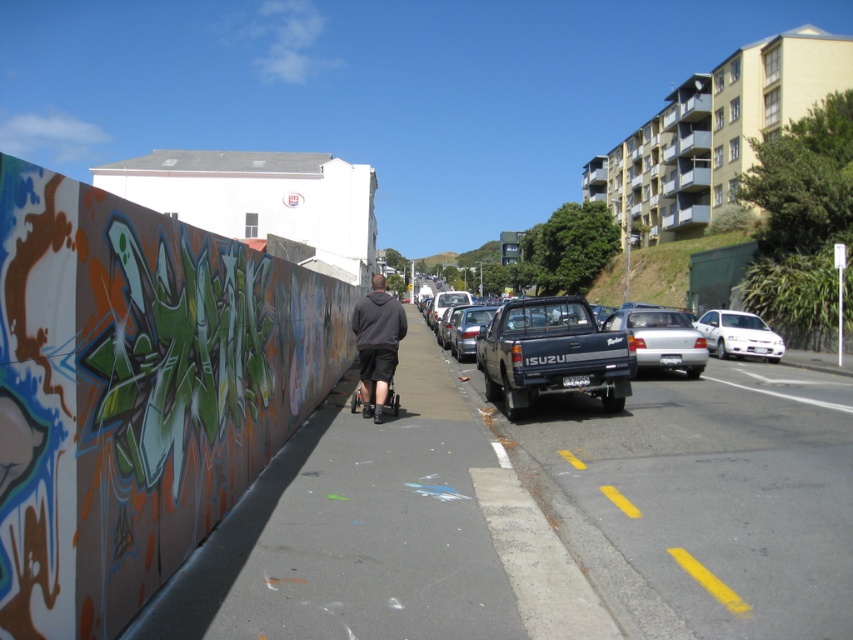
Can you confirm if black asphalt road at center is positioned to the left of matte black pickup truck at center?

In fact, black asphalt road at center is to the right of matte black pickup truck at center.

Identify the location of black asphalt road at center. (700, 497).

Who is higher up, black asphalt road at center or silver metallic sedan at center-right?

silver metallic sedan at center-right

Locate an element on the screen. This screenshot has height=640, width=853. black asphalt road at center is located at coordinates (700, 497).

Describe the element at coordinates (700, 497) in the screenshot. I see `black asphalt road at center` at that location.

Locate an element on the screen. The height and width of the screenshot is (640, 853). black asphalt road at center is located at coordinates (700, 497).

Is gray asphalt sidewalk at center taller than matte black pickup truck at center?

Incorrect, gray asphalt sidewalk at center's height is not larger of matte black pickup truck at center's.

Who is more distant from viewer, (399, 364) or (590, 348)?

Positioned behind is point (399, 364).

Between point (404, 520) and point (563, 369), which one is positioned behind?

Point (563, 369)

The width and height of the screenshot is (853, 640). Identify the location of gray asphalt sidewalk at center. (381, 534).